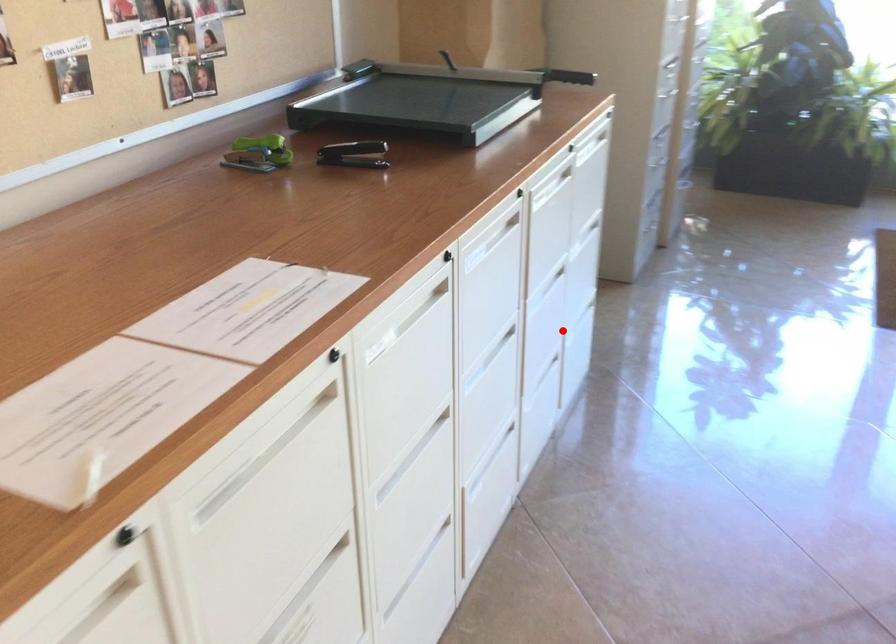
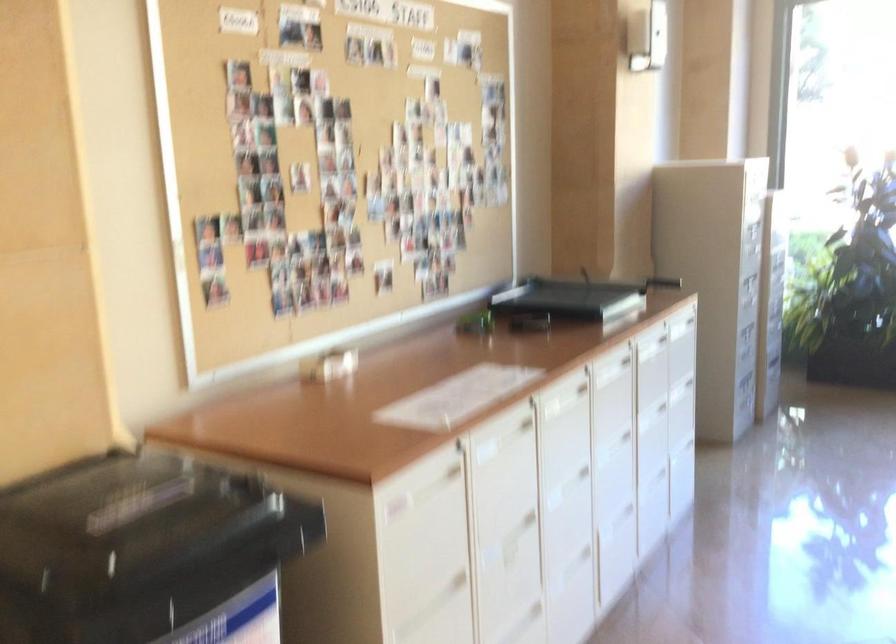
Question: I am providing you with two images of the same scene from different viewpoints. Image1 has a red point marked. In image2, the corresponding 3D location appears at what relative position? Reply with the corresponding letter.

Choices:
 (A) Closer
 (B) Farther

Answer: (B)